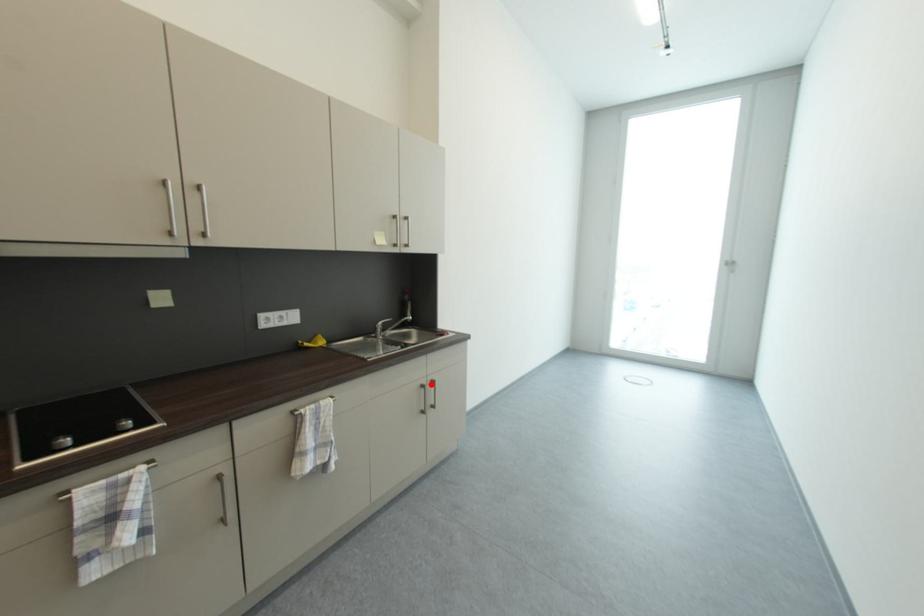
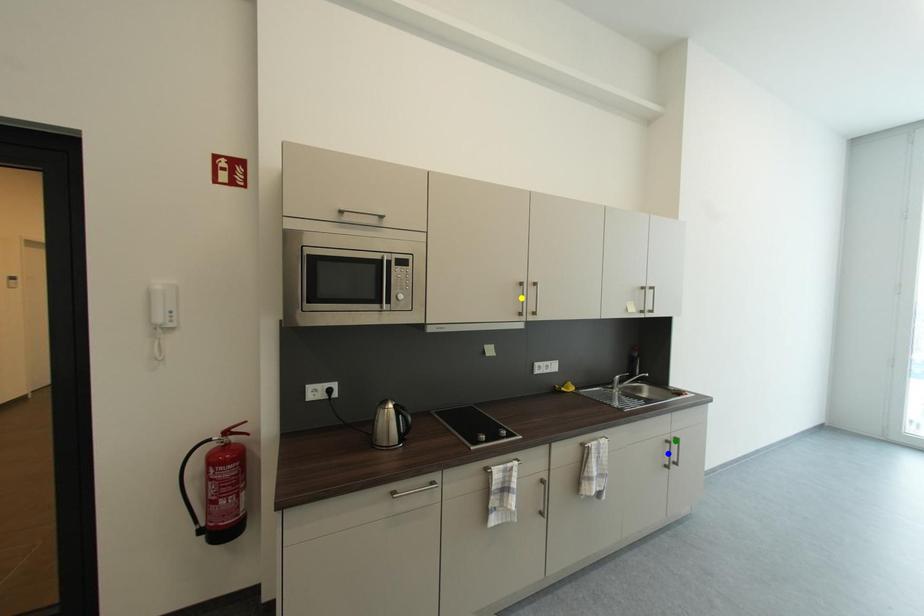
Question: I am providing you with two images of the same scene from different viewpoints. A red point is marked on the first image. You are given multiple points on the second image. In image 2, which mark is for the same physical point as the one in image 1?

Choices:
 (A) yellow point
 (B) blue point
 (C) green point

Answer: (C)